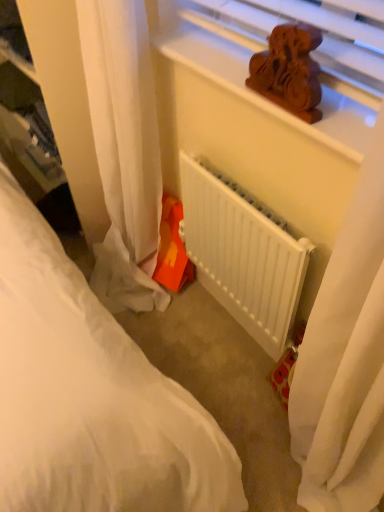
Question: Would you say wooden carving at upper center is inside or outside white matte radiator at center?

Choices:
 (A) inside
 (B) outside

Answer: (B)

Question: From their relative heights in the image, would you say wooden carving at upper center is taller or shorter than white matte radiator at center?

Choices:
 (A) tall
 (B) short

Answer: (B)

Question: Which object is positioned closest to the orange plastic toy at lower center?

Choices:
 (A) white sheer curtain at lower left
 (B) white matte radiator at center
 (C) wooden carving at upper center
 (D) brown wooden statue at upper center
 (E) white fabric bed at lower left

Answer: (A)

Question: Which of these objects is positioned farthest from the orange plastic toy at lower center?

Choices:
 (A) wooden carving at upper center
 (B) white sheer curtain at lower left
 (C) white matte radiator at center
 (D) brown wooden statue at upper center
 (E) white fabric bed at lower left

Answer: (D)